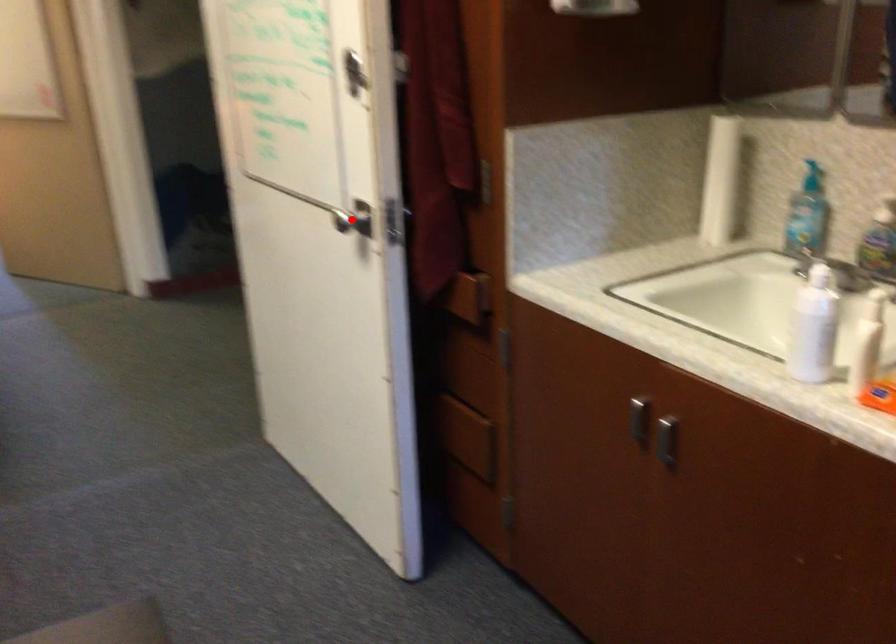
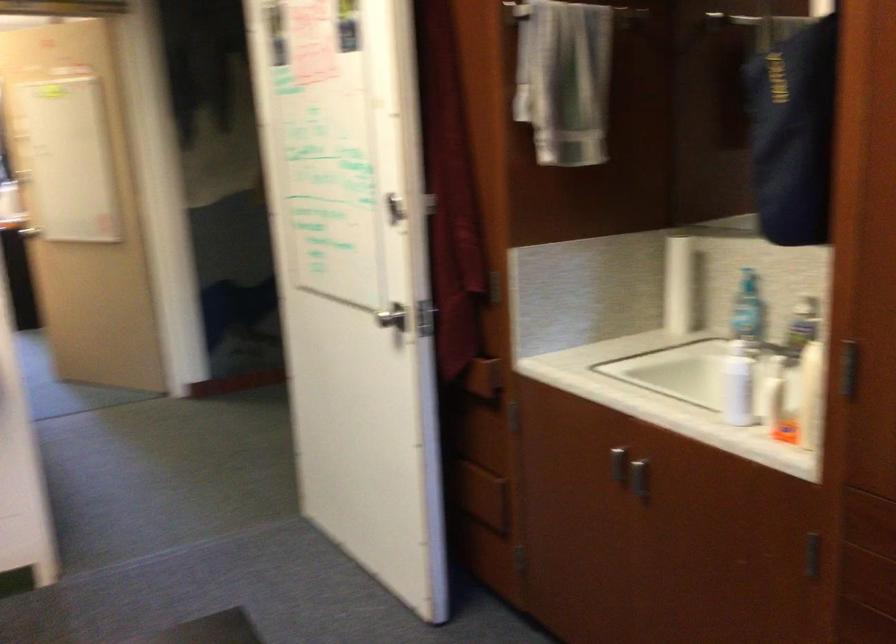
In the second image, find the point that corresponds to the highlighted location in the first image.

(391, 317)